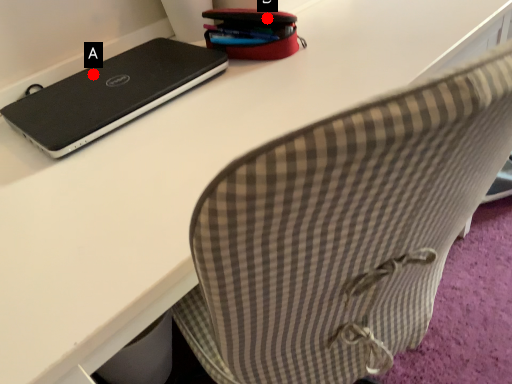
Question: Two points are circled on the image, labeled by A and B beside each circle. Which point is closer to the camera taking this photo?

Choices:
 (A) A is closer
 (B) B is closer

Answer: (A)